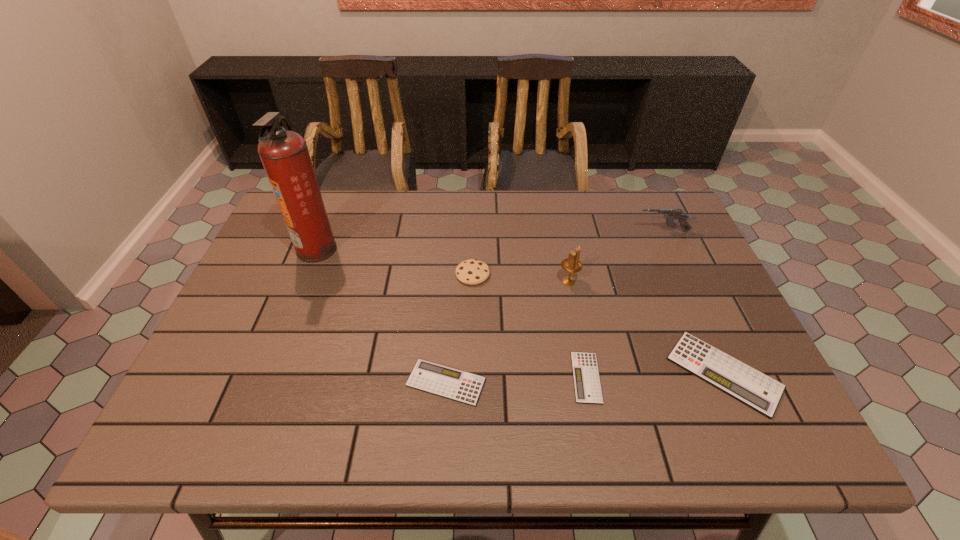
Locate an element on the screen. The image size is (960, 540). the leftmost calculator is located at coordinates (448, 382).

The image size is (960, 540). What are the coordinates of `the second tallest calculator` in the screenshot? It's located at (448, 382).

I want to click on the second calculator from right to left, so click(587, 386).

Find the location of `the shortest calculator`. the shortest calculator is located at coordinates (587, 386).

Locate an element on the screen. the third shortest object is located at coordinates (749, 386).

Where is `the tallest calculator`? This screenshot has height=540, width=960. the tallest calculator is located at coordinates (749, 386).

This screenshot has width=960, height=540. What are the coordinates of `gun` in the screenshot? It's located at (671, 214).

Image resolution: width=960 pixels, height=540 pixels. In order to click on the tallest object in this screenshot , I will do `click(284, 154)`.

The width and height of the screenshot is (960, 540). I want to click on fire extinguisher, so click(x=284, y=154).

The height and width of the screenshot is (540, 960). I want to click on cookie, so click(471, 272).